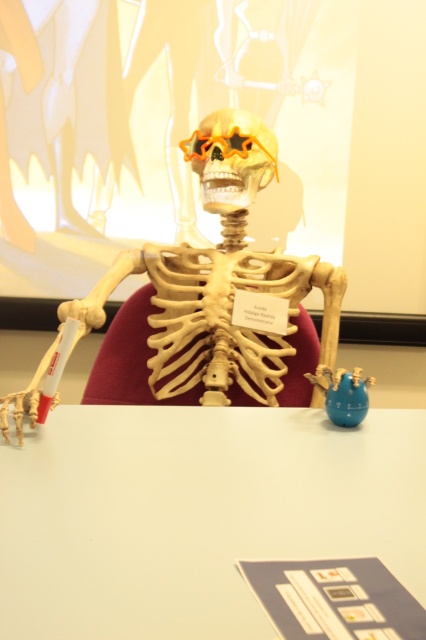
Is white matte table at center to the left of orange plastic skull at center from the viewer's perspective?

Indeed, white matte table at center is positioned on the left side of orange plastic skull at center.

Who is more distant from viewer, (402, 472) or (218, 138)?

The point (218, 138) is more distant.

At what (x,y) coordinates should I click in order to perform the action: click on white matte table at center. Please return your answer as a coordinate pair (x, y). Looking at the image, I should click on (195, 515).

Identify the location of white matte table at center. The width and height of the screenshot is (426, 640). (195, 515).